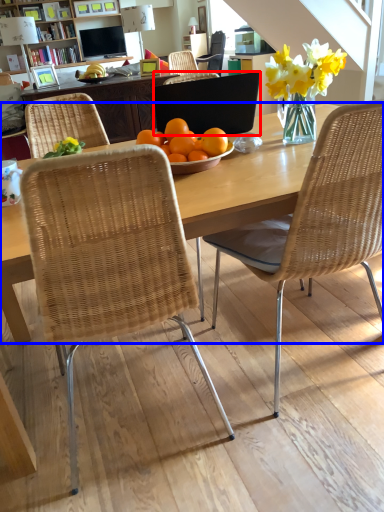
Question: Which point is closer to the camera, laptop (highlighted by a red box) or desk (highlighted by a blue box)?

Choices:
 (A) laptop
 (B) desk

Answer: (B)